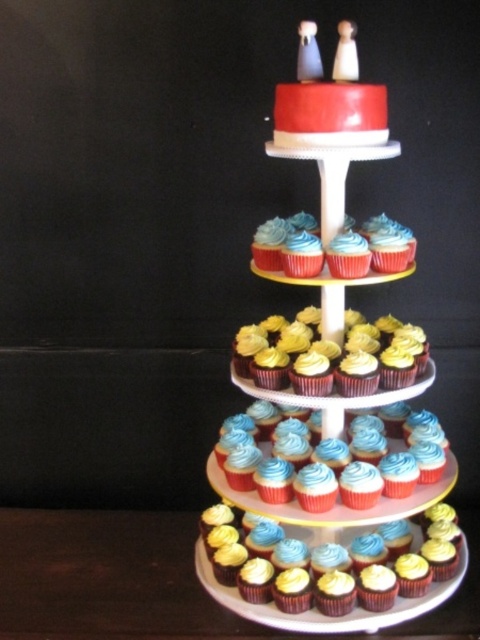
Image resolution: width=480 pixels, height=640 pixels. Describe the element at coordinates (335, 476) in the screenshot. I see `matte blue frosting cupcake at center` at that location.

Between point (325, 512) and point (462, 566), which one is positioned in front?

Point (325, 512) is in front.

Does point (338, 456) come closer to viewer compared to point (450, 579)?

That is True.

Where is `matte blue frosting cupcake at center`? matte blue frosting cupcake at center is located at coordinates (335, 476).

Which of these two, smooth red cake at upper center or matte blue frosting cupcake at center, stands taller?

smooth red cake at upper center

Measure the distance between point (405, 468) and camera.

The distance of point (405, 468) from camera is 1.12 meters.

In order to click on smooth red cake at upper center in this screenshot , I will do pos(330,397).

Locate an element on the screen. This screenshot has height=640, width=480. smooth red cake at upper center is located at coordinates (330, 397).

Can you confirm if smooth red cake at upper center is smaller than smooth chocolate cupcake at lower center?

Incorrect, smooth red cake at upper center is not smaller in size than smooth chocolate cupcake at lower center.

Describe the element at coordinates (330, 397) in the screenshot. I see `smooth red cake at upper center` at that location.

Find the location of a particular element. This screenshot has width=480, height=640. smooth red cake at upper center is located at coordinates tap(330, 397).